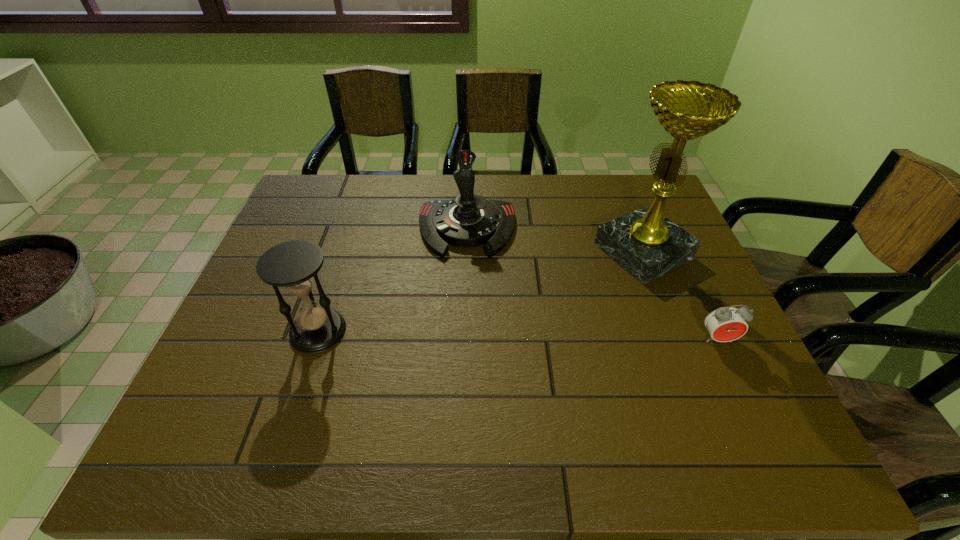
At what (x,y) coordinates should I click in order to perform the action: click on hourglass. Please return your answer as a coordinate pair (x, y). The image size is (960, 540). Looking at the image, I should click on (293, 265).

The height and width of the screenshot is (540, 960). Identify the location of the shortest object. (725, 324).

Locate an element on the screen. The height and width of the screenshot is (540, 960). joystick is located at coordinates (469, 220).

Locate an element on the screen. award is located at coordinates (644, 242).

At what (x,y) coordinates should I click in order to perform the action: click on free space located on the right of the hourglass. Please return your answer as a coordinate pair (x, y). This screenshot has height=540, width=960. Looking at the image, I should click on (413, 331).

The width and height of the screenshot is (960, 540). What are the coordinates of `vacant position located on the face of the shortest object` in the screenshot? It's located at (737, 381).

Find the location of a particular element. The image size is (960, 540). vacant space located 0.340m on the handle side of the joystick is located at coordinates (462, 362).

Find the location of a particular element. vacant space located on the handle side of the joystick is located at coordinates (465, 280).

Find the location of a particular element. This screenshot has width=960, height=540. free space located 0.320m on the handle side of the joystick is located at coordinates (463, 355).

The width and height of the screenshot is (960, 540). Identify the location of blank space located 0.170m on the front-facing side of the award. (559, 291).